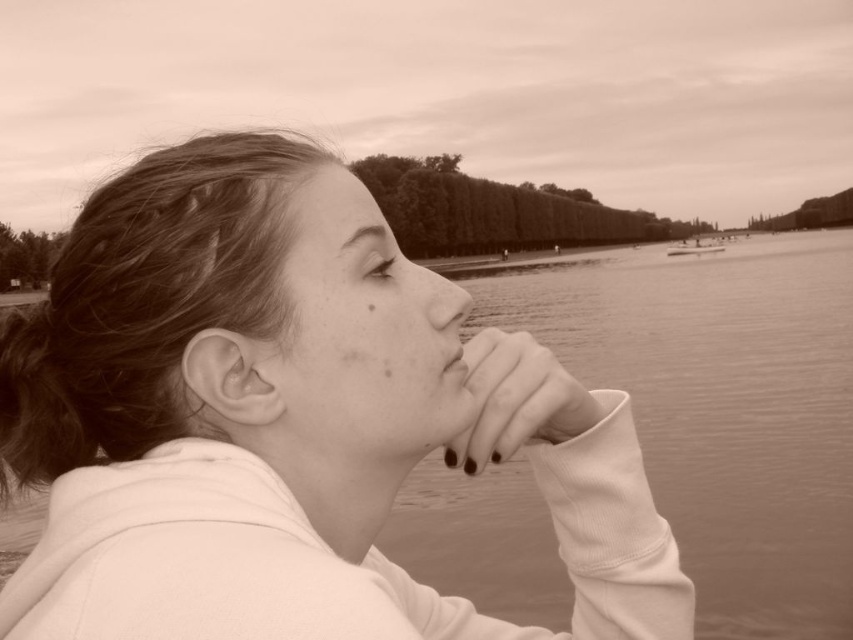
Question: Is sepia water at center positioned behind smooth white boat at center?

Choices:
 (A) yes
 (B) no

Answer: (B)

Question: Which point appears farthest from the camera in this image?

Choices:
 (A) (434, 413)
 (B) (666, 248)
 (C) (740, 516)
 (D) (460, 348)

Answer: (B)

Question: Observing the image, what is the correct spatial positioning of smooth skin nose at center in reference to smooth white boat at center?

Choices:
 (A) right
 (B) left

Answer: (B)

Question: Can you confirm if sepia water at center is wider than smooth skin nose at center?

Choices:
 (A) yes
 (B) no

Answer: (A)

Question: Which point is farther from the camera taking this photo?

Choices:
 (A) (718, 241)
 (B) (543, 413)

Answer: (A)

Question: Considering the real-world distances, which object is farthest from the smooth skin nose at center?

Choices:
 (A) sepia water at center
 (B) smooth skin face at center
 (C) matte black nails at center

Answer: (A)